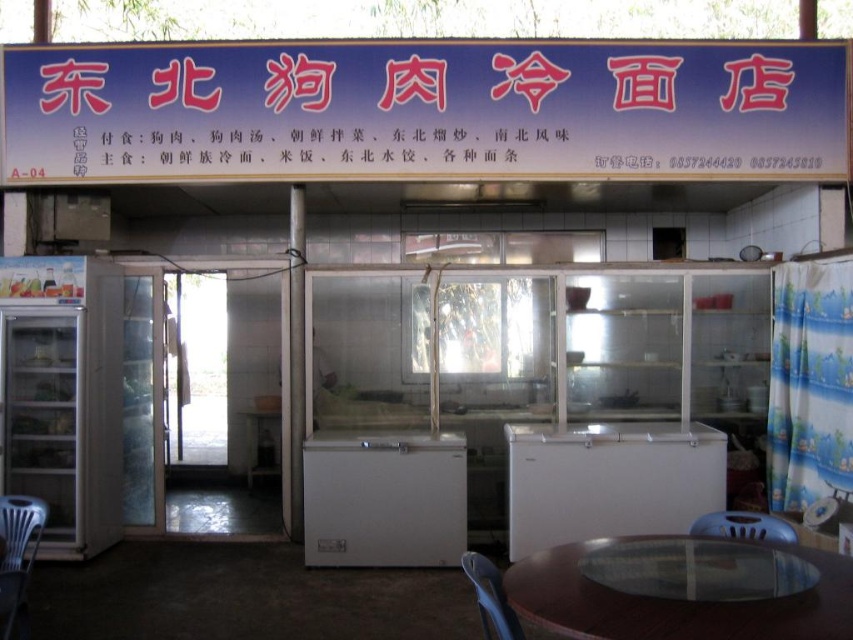
Question: Is blue plastic sign at upper center below transparent glass table at lower center?

Choices:
 (A) no
 (B) yes

Answer: (A)

Question: Which object is positioned farthest from the transparent glass table at lower center?

Choices:
 (A) blue plastic sign at upper center
 (B) white matte freezer at center

Answer: (A)

Question: Among these objects, which one is farthest from the camera?

Choices:
 (A) blue plastic chair at lower right
 (B) blue plastic chair at lower center
 (C) blue plastic sign at upper center

Answer: (C)

Question: Does blue plastic sign at upper center appear over white matte freezer at center?

Choices:
 (A) yes
 (B) no

Answer: (A)

Question: Can you confirm if blue plastic chair at lower center is smaller than blue plastic chair at lower right?

Choices:
 (A) no
 (B) yes

Answer: (A)

Question: Which point appears closest to the camera in this image?

Choices:
 (A) (793, 531)
 (B) (466, 560)

Answer: (B)